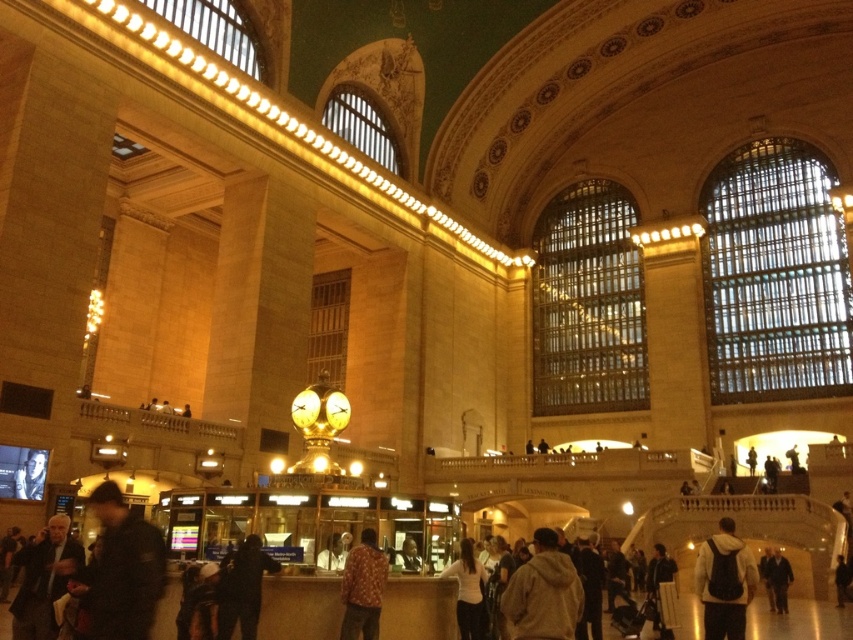
Question: Among these objects, which one is farthest from the camera?

Choices:
 (A) white hoodie at center
 (B) light brown hoodie at center

Answer: (A)

Question: Can you confirm if light brown hoodie at center is bigger than white hoodie at center?

Choices:
 (A) no
 (B) yes

Answer: (B)

Question: Which point is closer to the camera taking this photo?

Choices:
 (A) (563, 564)
 (B) (732, 627)
 (C) (769, 588)
 (D) (125, 532)

Answer: (D)

Question: Where is dark gray jacket at lower left located in relation to floral shirt at center in the image?

Choices:
 (A) left
 (B) right

Answer: (A)

Question: Among these points, which one is nearest to the camera?

Choices:
 (A) (476, 586)
 (B) (154, 541)

Answer: (B)

Question: Can you confirm if white hoodie at center is positioned above dark gray hoodie at lower center?

Choices:
 (A) yes
 (B) no

Answer: (B)